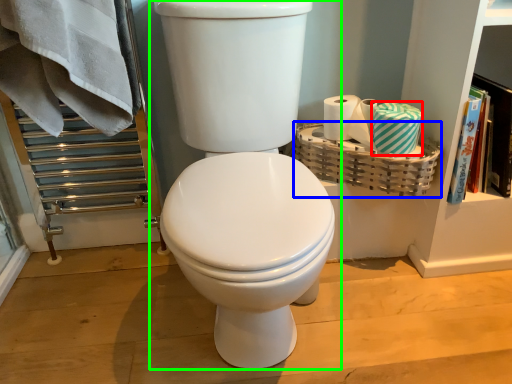
Question: Which is nearer to the material (highlighted by a red box)? basket (highlighted by a blue box) or toilet (highlighted by a green box).

Choices:
 (A) basket
 (B) toilet

Answer: (A)